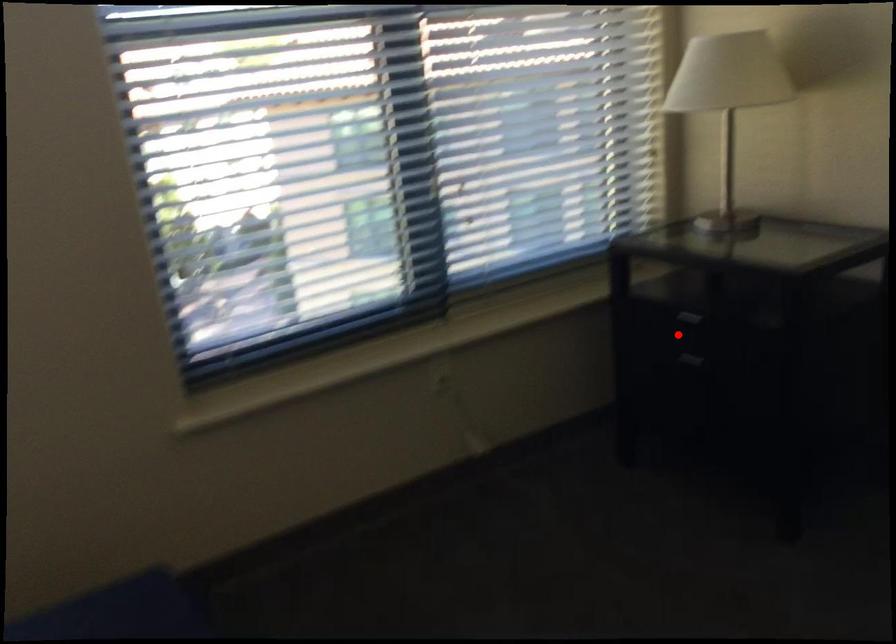
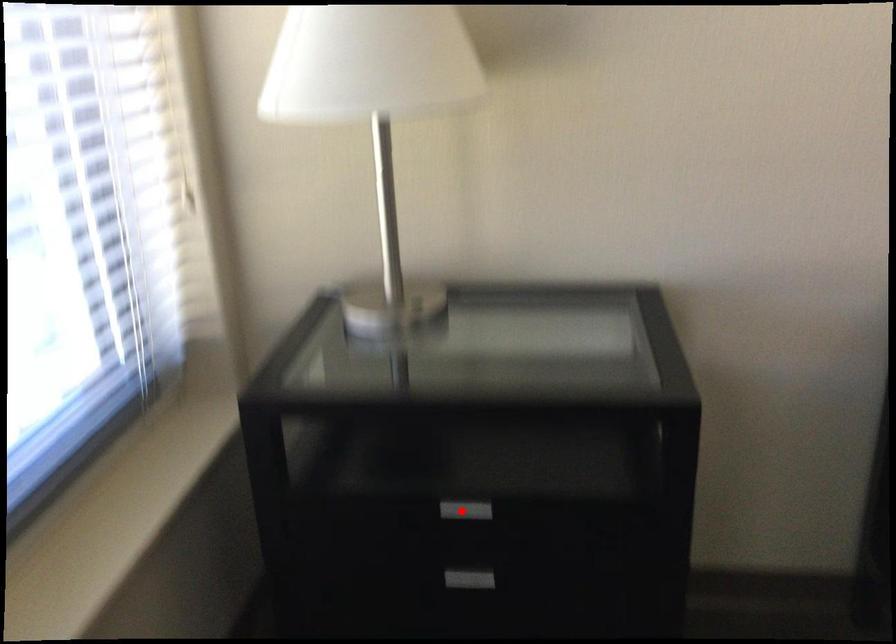
I am providing you with two images of the same scene from different viewpoints. A red point is marked on the first image and another point is marked on the second image. Is the red point in image1 aligned with the point shown in image2?

Yes